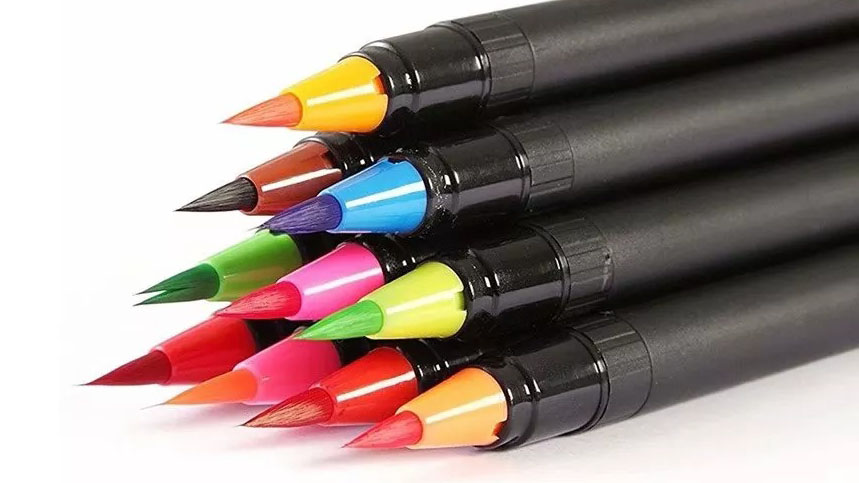
Where is `marker`? marker is located at coordinates (516, 401), (396, 374), (288, 368), (216, 342), (437, 306), (327, 286), (262, 271), (387, 207), (297, 170), (381, 84).